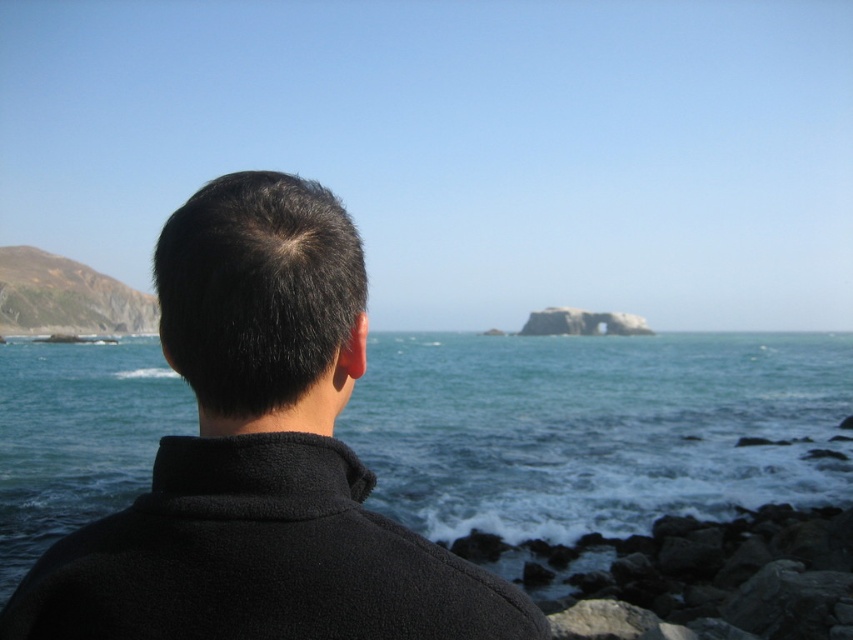
You are standing behind the person in the image and want to place two markers at the specified points. Which point, point (51, 449) or point (53, 323), is closer to you?

Point (51, 449) is closer to the viewer than point (53, 323).

You are standing behind the person in the image and want to walk towards the point marked as point (717, 602). Is this point closer to you than the point marked as point (22, 316)?

Point (717, 602) is in front of point (22, 316), so yes, it is closer to you.

You are standing behind the person in the image. If you want to look directly at the blue water at center, where should you move relative to the person? Please provide coordinates in the format of x,y where x and y are between 0 and 1, with 0,0 being the bottom left corner of the image and 1,1 being the top right corner.

The blue water at center is located at coordinates (596, 428). To look directly at it, you should move to that position relative to the person.